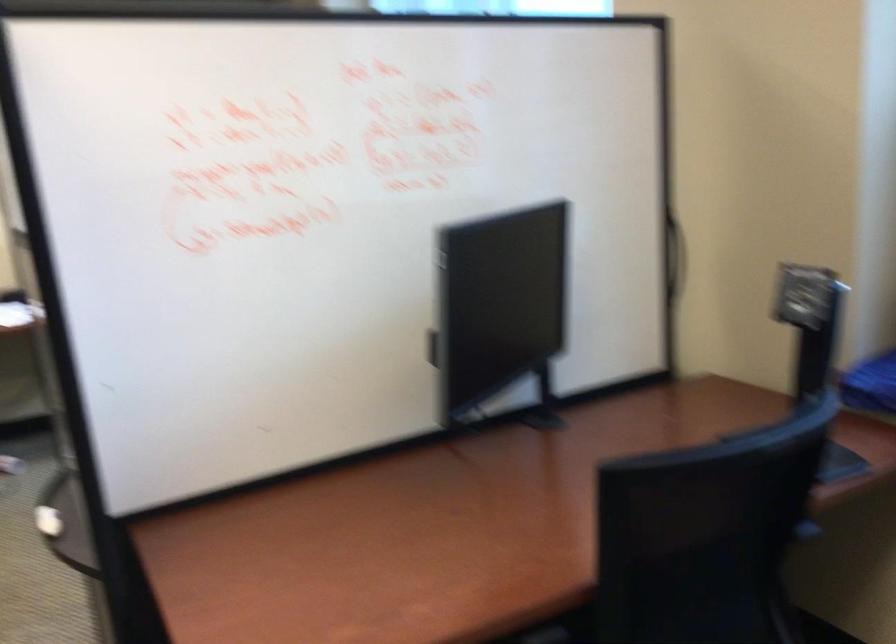
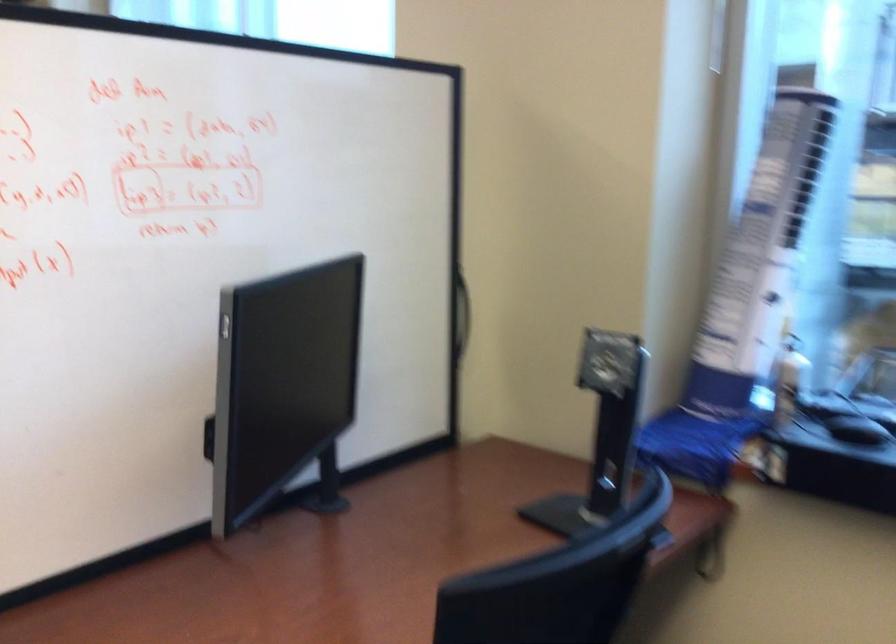
Find the pixel in the second image that matches the point at 679,259 in the first image.

(461, 313)